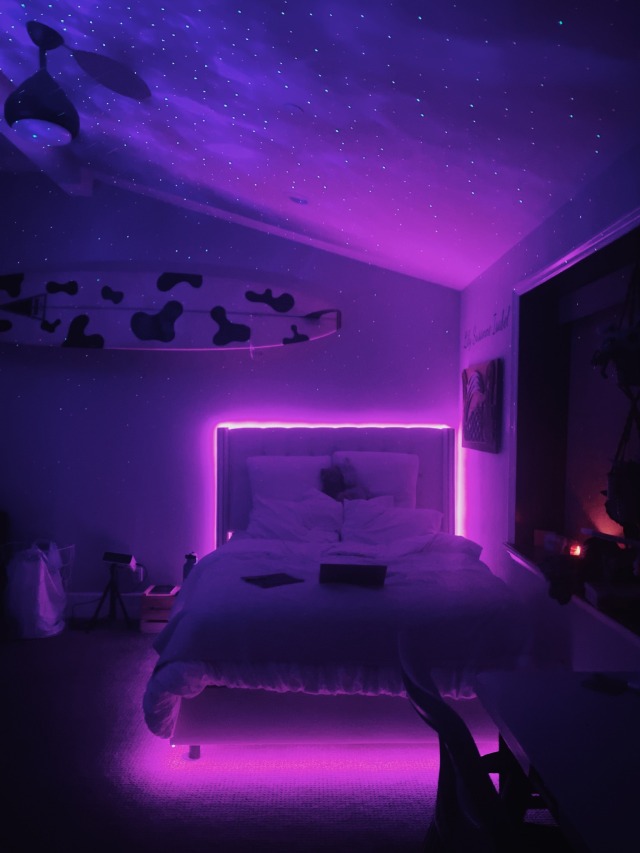
Identify the location of ceiling. (374, 55).